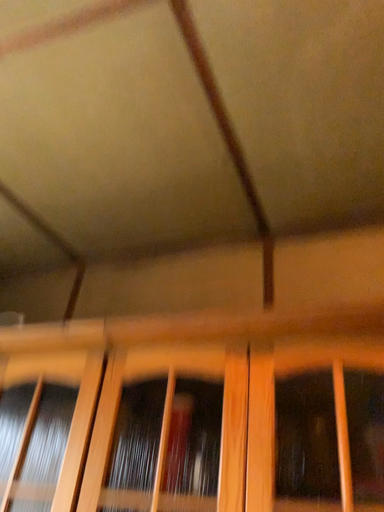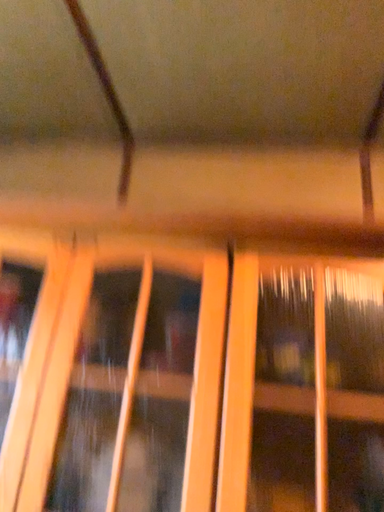
Question: Which way did the camera rotate in the video?

Choices:
 (A) rotated downward
 (B) rotated upward

Answer: (A)